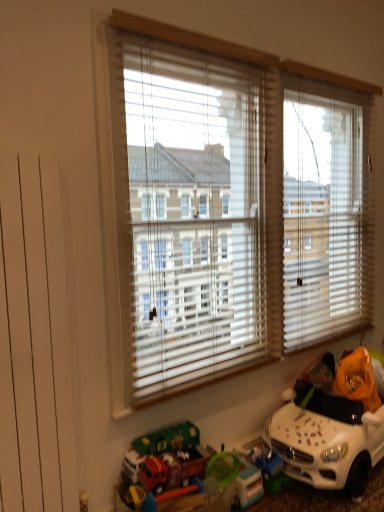
Question: Which direction should I rotate to look at red plastic fire truck at lower center, the first toy positioned from the left, — up or down?

Choices:
 (A) up
 (B) down

Answer: (B)

Question: From the image's perspective, is white plastic toy car at lower right, the 1th toy in the right-to-left sequence, on red plastic fire truck at lower center, the 2th toy when ordered from right to left?

Choices:
 (A) yes
 (B) no

Answer: (A)

Question: Can you confirm if white plastic toy car at lower right, acting as the 2th toy starting from the left, is positioned to the left of red plastic fire truck at lower center, the first toy positioned from the left?

Choices:
 (A) yes
 (B) no

Answer: (B)

Question: Is the position of white plastic toy car at lower right, acting as the 2th toy starting from the left, less distant than that of red plastic fire truck at lower center, the 2th toy when ordered from right to left?

Choices:
 (A) no
 (B) yes

Answer: (A)

Question: Does white plastic toy car at lower right, the 1th toy in the right-to-left sequence, have a greater height compared to red plastic fire truck at lower center, the 2th toy when ordered from right to left?

Choices:
 (A) no
 (B) yes

Answer: (B)

Question: Is white plastic toy car at lower right, the 1th toy in the right-to-left sequence, completely or partially outside of red plastic fire truck at lower center, the 2th toy when ordered from right to left?

Choices:
 (A) yes
 (B) no

Answer: (A)

Question: From the image's perspective, does white plastic toy car at lower right, acting as the 2th toy starting from the left, appear lower than red plastic fire truck at lower center, the first toy positioned from the left?

Choices:
 (A) yes
 (B) no

Answer: (B)

Question: Does white plastic toy car at lower right, acting as the 2th toy starting from the left, have a lesser width compared to white blinds at center?

Choices:
 (A) yes
 (B) no

Answer: (B)

Question: Are white plastic toy car at lower right, acting as the 2th toy starting from the left, and white blinds at center far apart?

Choices:
 (A) yes
 (B) no

Answer: (B)

Question: Could you tell me if white plastic toy car at lower right, acting as the 2th toy starting from the left, is turned towards white blinds at center?

Choices:
 (A) yes
 (B) no

Answer: (B)

Question: Is white plastic toy car at lower right, acting as the 2th toy starting from the left, further to camera compared to white blinds at center?

Choices:
 (A) yes
 (B) no

Answer: (A)

Question: From the image's perspective, is white plastic toy car at lower right, the 1th toy in the right-to-left sequence, located beneath white blinds at center?

Choices:
 (A) no
 (B) yes

Answer: (B)

Question: Can you confirm if white plastic toy car at lower right, the 1th toy in the right-to-left sequence, is smaller than white blinds at center?

Choices:
 (A) yes
 (B) no

Answer: (A)

Question: Is red plastic fire truck at lower center, the first toy positioned from the left, taller than white plastic toy car at lower right, acting as the 2th toy starting from the left?

Choices:
 (A) yes
 (B) no

Answer: (B)